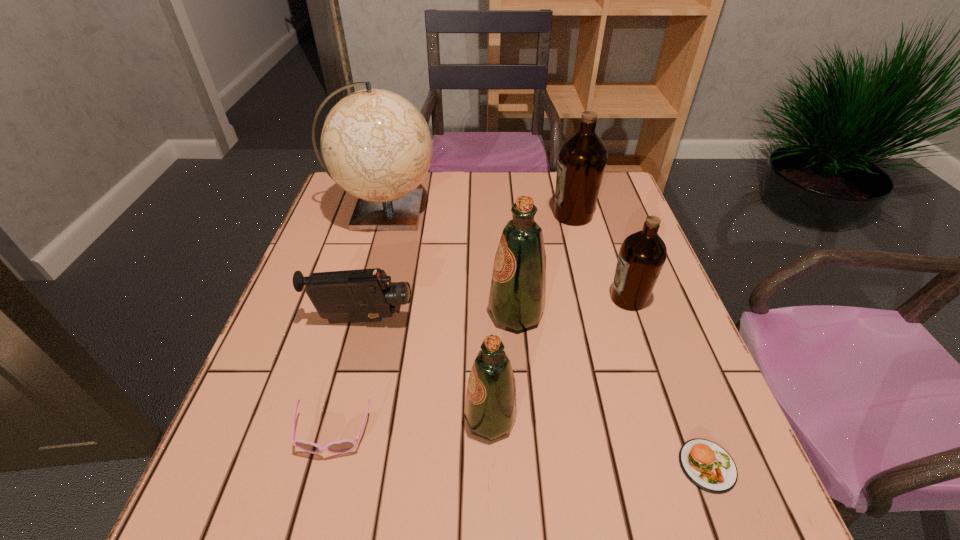
At what (x,y) coordinates should I click in order to perform the action: click on olive oil located at the far edge. Please return your answer as a coordinate pair (x, y). Looking at the image, I should click on (582, 158).

At what (x,y) coordinates should I click in order to perform the action: click on object present at the near edge. Please return your answer as a coordinate pair (x, y). Looking at the image, I should click on (706, 464).

What are the coordinates of `globe at the left edge` in the screenshot? It's located at (377, 146).

Where is `camcorder present at the left edge`? camcorder present at the left edge is located at coordinates (363, 295).

The width and height of the screenshot is (960, 540). Find the location of `sunglasses present at the left edge`. sunglasses present at the left edge is located at coordinates (344, 446).

Identify the location of patty that is positioned at the right edge. The image size is (960, 540). (706, 464).

Locate an element on the screen. The width and height of the screenshot is (960, 540). object positioned at the far left corner is located at coordinates (377, 146).

The image size is (960, 540). In order to click on object positioned at the far right corner in this screenshot , I will do `click(582, 158)`.

At what (x,y) coordinates should I click in order to perform the action: click on object that is at the near right corner. Please return your answer as a coordinate pair (x, y). This screenshot has height=540, width=960. Looking at the image, I should click on (706, 464).

Locate an element on the screen. vacant space at the far edge is located at coordinates (517, 171).